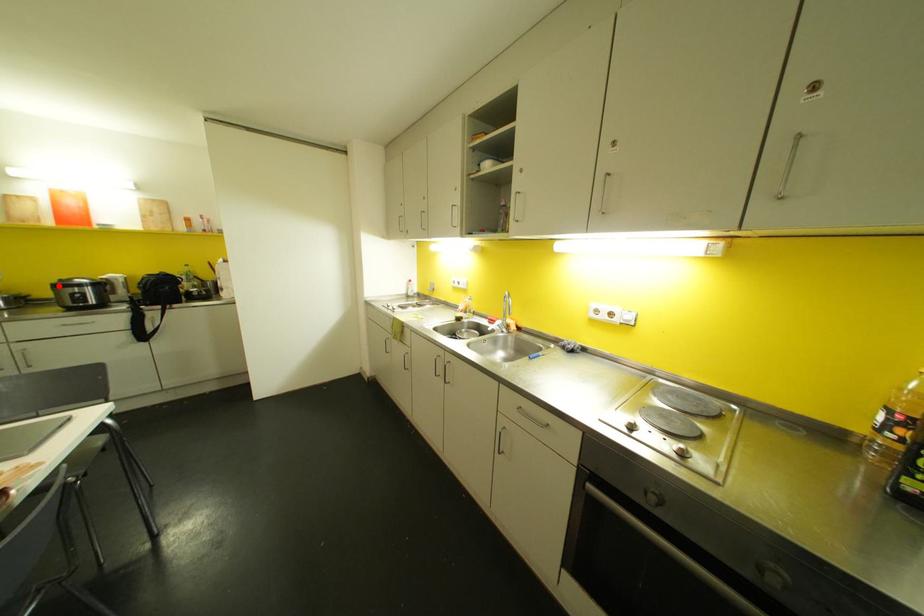
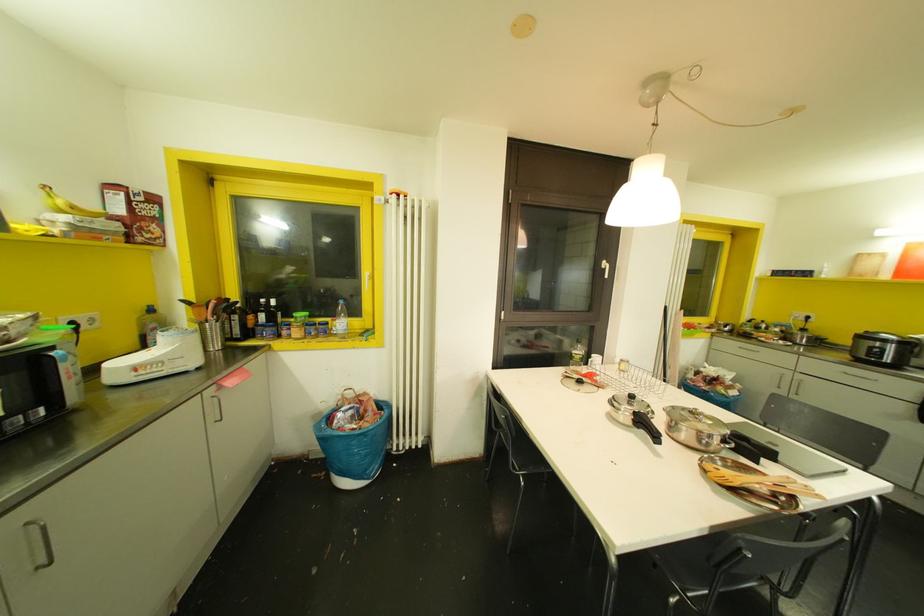
Locate, in the second image, the point that corresponds to the highlighted location in the first image.

(861, 336)